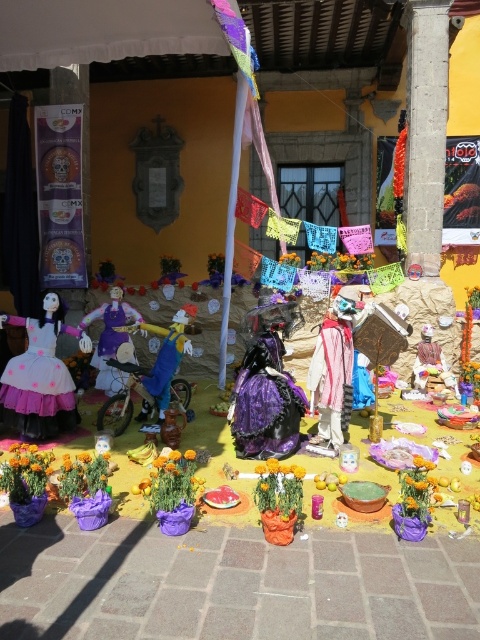
Question: Which of these objects is positioned closest to the matte pink fabric doll at center?

Choices:
 (A) vibrant orange petals at center
 (B) orange matte flower at lower center

Answer: (A)

Question: Which point is closer to the camera?

Choices:
 (A) matte pink fabric doll at center
 (B) orange matte flower at lower center

Answer: (B)

Question: Among these objects, which one is nearest to the camera?

Choices:
 (A) orange matte flower at lower center
 (B) matte pink fabric doll at center
 (C) vibrant orange petals at center

Answer: (A)

Question: Is matte pink fabric doll at center to the right of orange matte flower at lower center from the viewer's perspective?

Choices:
 (A) yes
 (B) no

Answer: (B)

Question: Is matte pink fabric doll at center thinner than vibrant orange petals at center?

Choices:
 (A) yes
 (B) no

Answer: (B)

Question: Considering the relative positions of matte pink fabric doll at center and vibrant orange petals at center in the image provided, where is matte pink fabric doll at center located with respect to vibrant orange petals at center?

Choices:
 (A) right
 (B) left

Answer: (B)